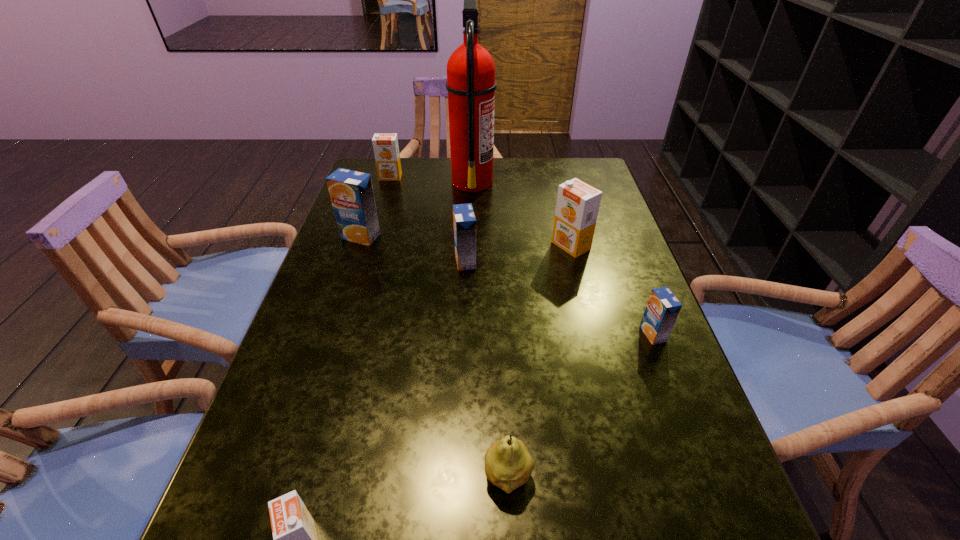
Image resolution: width=960 pixels, height=540 pixels. Identify the location of the second nearest orange juice. (663, 307).

In order to click on the rightmost blue orange_juice in this screenshot , I will do `click(663, 307)`.

Locate an element on the screen. Image resolution: width=960 pixels, height=540 pixels. vacant space located 0.140m on the side of the fire extinguisher near the handle is located at coordinates (539, 181).

Locate an element on the screen. The image size is (960, 540). vacant space located 0.380m on the back of the leftmost blue orange_juice is located at coordinates coord(386,161).

Where is `vacant area situated 0.050m on the back of the biggest orange orange juice`? vacant area situated 0.050m on the back of the biggest orange orange juice is located at coordinates (565, 223).

You are a GUI agent. You are given a task and a screenshot of the screen. Output one action in this format:
    pyautogui.click(x=<x>, y=<y>)
    Task: Click on the free spot located on the right of the fourth orange juice from left to right
    
    Given the screenshot: What is the action you would take?
    pyautogui.click(x=637, y=261)

Find the location of a particular element. This screenshot has height=540, width=960. vacant space located 0.210m on the right of the second biggest orange orange juice is located at coordinates (468, 177).

You are a GUI agent. You are given a task and a screenshot of the screen. Output one action in this format:
    pyautogui.click(x=<x>, y=<y>)
    Task: Click on the blank space located 0.380m on the back of the pear
    This screenshot has width=960, height=540.
    Given the screenshot: What is the action you would take?
    pyautogui.click(x=499, y=293)

You are a GUI agent. You are given a task and a screenshot of the screen. Output one action in this format:
    pyautogui.click(x=<x>, y=<y>)
    Task: Click on the vacant space located 0.190m on the back of the fifth farthest orange juice
    
    Given the screenshot: What is the action you would take?
    pyautogui.click(x=627, y=266)

Identify the location of fire extinguisher that is at the far edge. (471, 85).